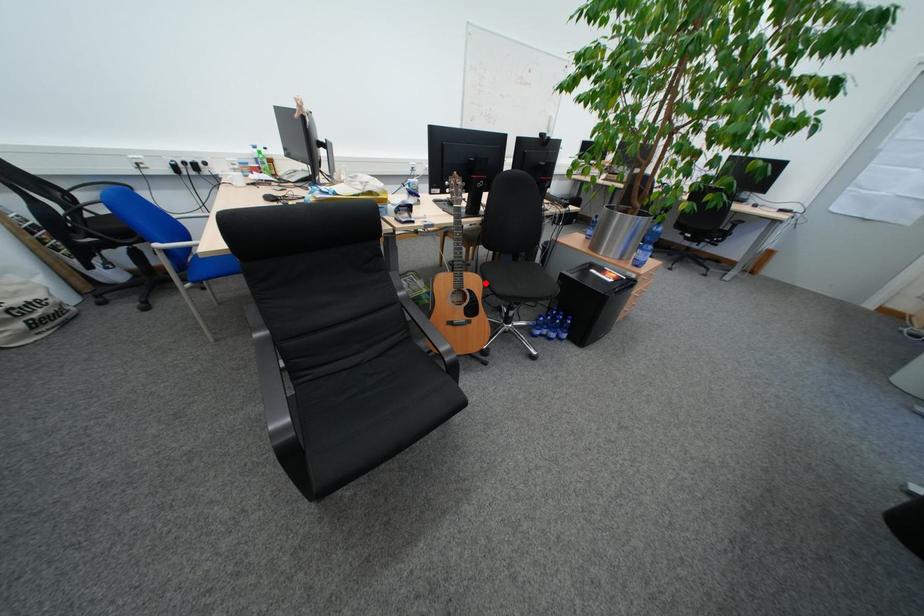
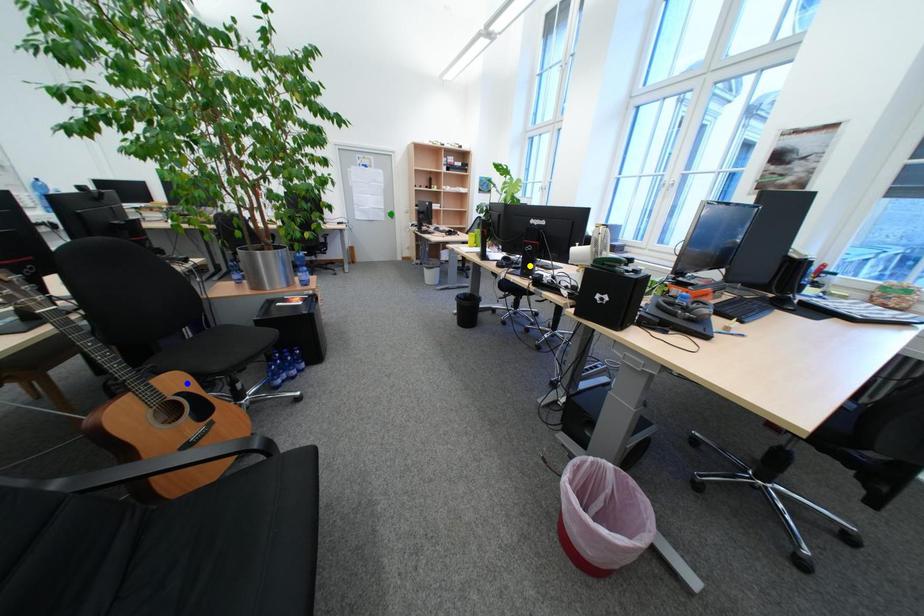
Question: I am providing you with two images of the same scene from different viewpoints. A red point is marked on the first image. You are given multiple points on the second image. Can you choose the point in image 2 that corresponds to the point in image 1?

Choices:
 (A) green point
 (B) blue point
 (C) yellow point

Answer: (B)